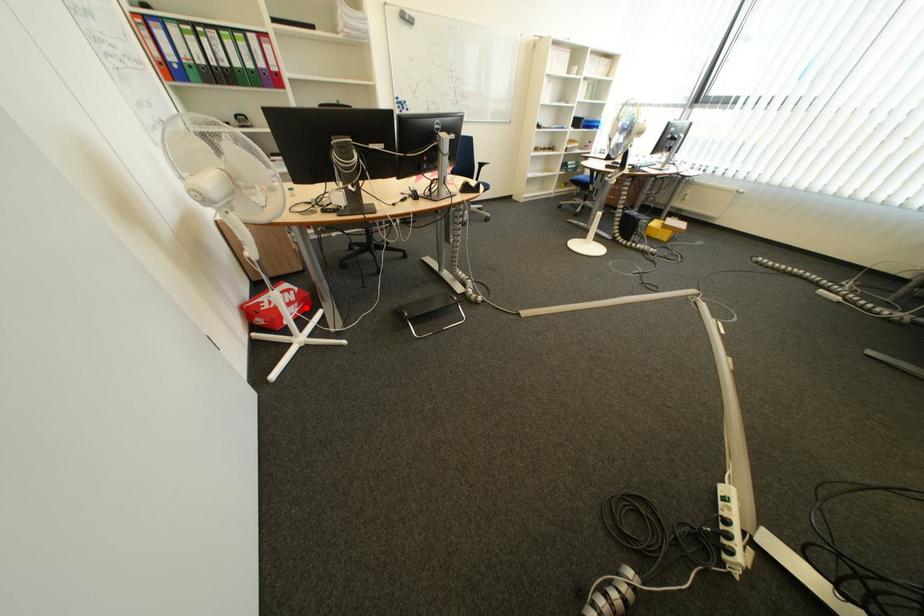
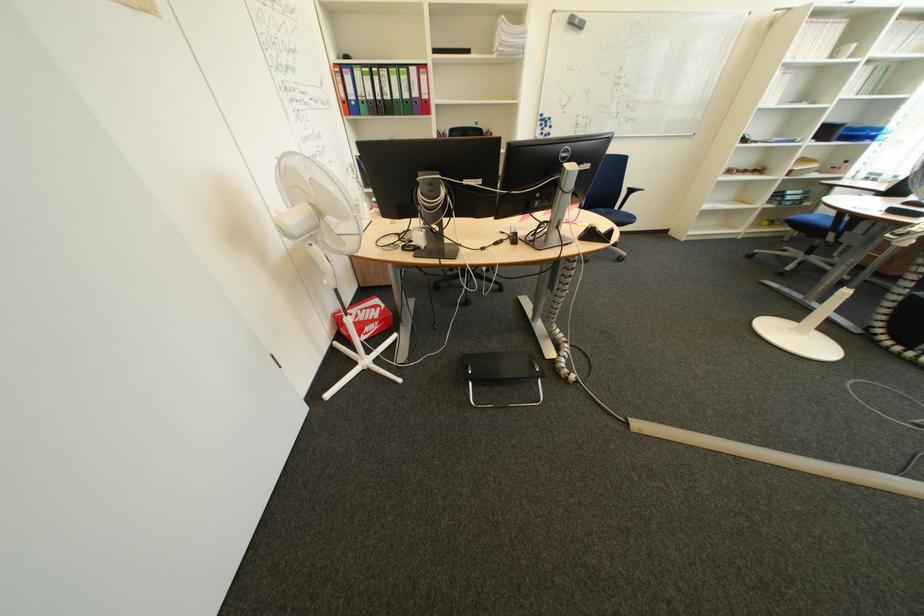
Locate, in the second image, the point that corresponds to the highlighted location in the first image.

(385, 326)